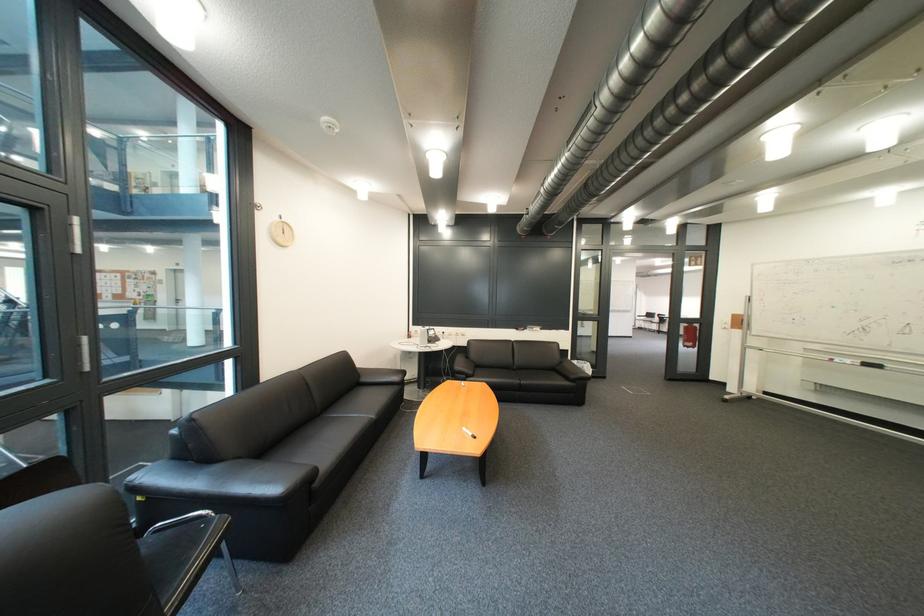
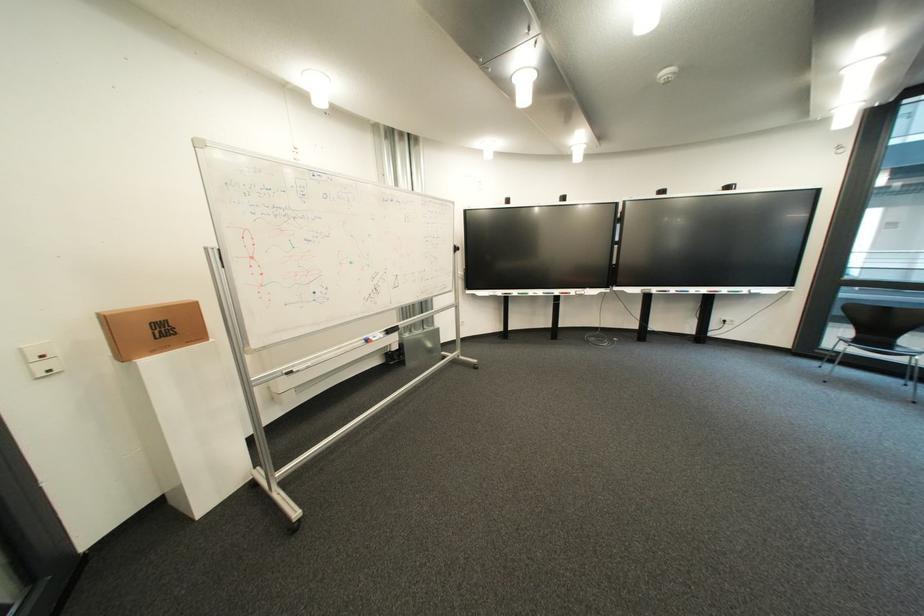
In the second image, find the point that corresponds to the point at 747,329 in the first image.

(139, 358)